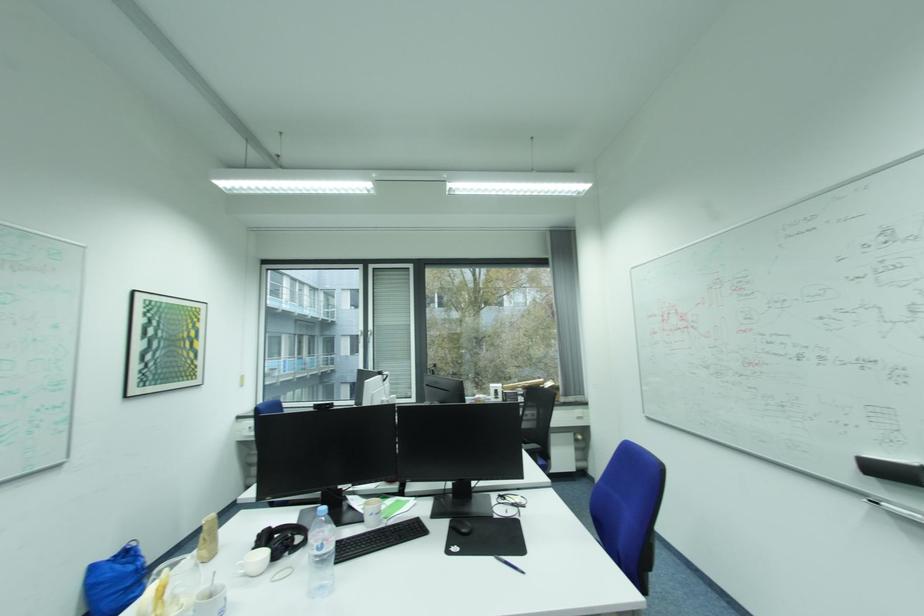
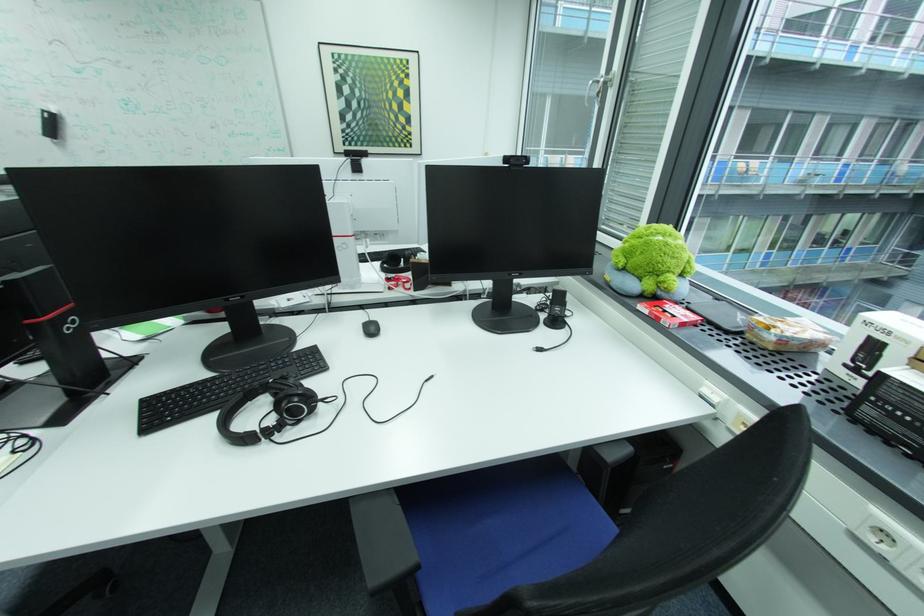
Find the pixel in the second image that matches point (502, 387) in the first image.

(876, 323)